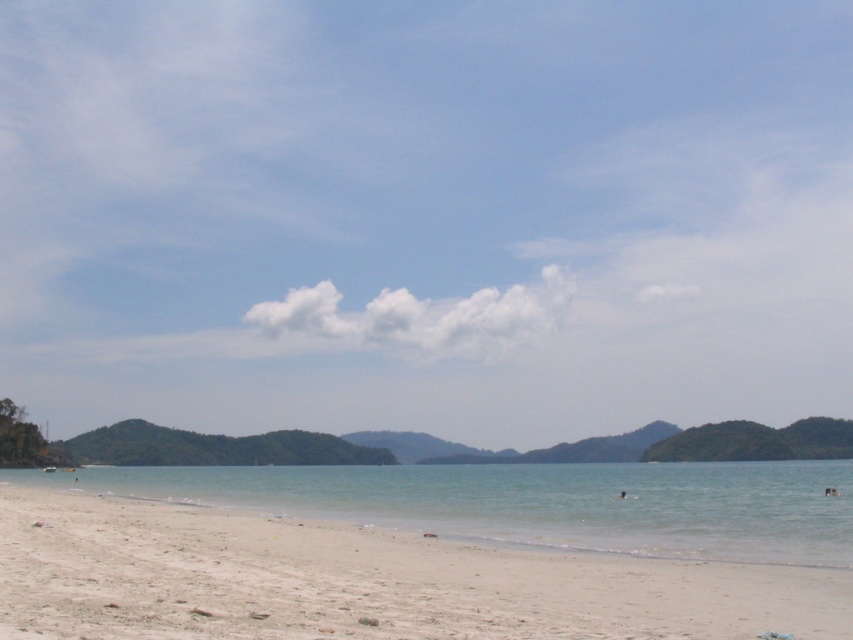
Consider the image. You are standing on the white sandy beach at lower left and want to reach the clear water at beach center. Which direction should you move to get closer to the water?

You should move towards the center of the beach because the clear water at beach center is taller than the white sandy beach at lower left, so moving towards the center will bring you closer to the water.